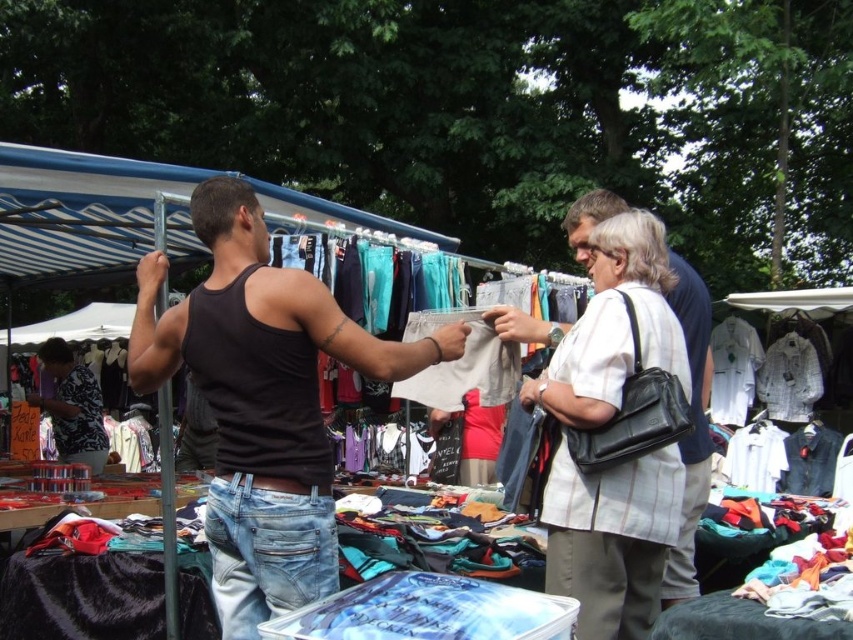
Question: Is the position of jeans at lower center more distant than that of printed cotton shirt at center?

Choices:
 (A) no
 (B) yes

Answer: (A)

Question: Which point appears farthest from the camera in this image?

Choices:
 (A) pos(303,538)
 (B) pos(569,358)
 (C) pos(322,536)
 (D) pos(90,413)

Answer: (D)

Question: Which of the following is the closest to the observer?

Choices:
 (A) white striped shirt at center
 (B) white cotton shirt at center right
 (C) black matte tank top at center
 (D) jeans at lower center

Answer: (A)

Question: In this image, where is black matte tank top at center located relative to white striped shirt at center?

Choices:
 (A) right
 (B) left

Answer: (B)

Question: Among these points, which one is farthest from the camera?

Choices:
 (A) (96, 468)
 (B) (732, 381)
 (C) (260, 545)
 (D) (144, 380)

Answer: (B)

Question: From the image, what is the correct spatial relationship of black matte tank top at center in relation to jeans at lower center?

Choices:
 (A) above
 (B) below

Answer: (A)